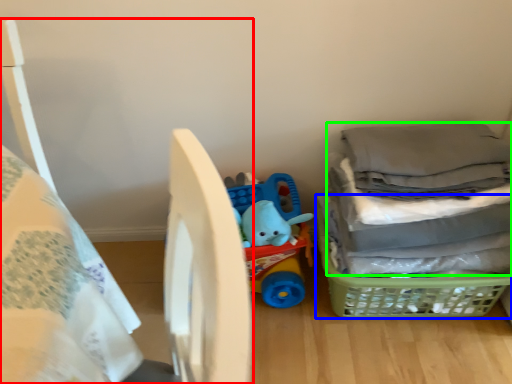
Question: Which object is positioned closest to bed (highlighted by a red box)? Select from basket (highlighted by a blue box) and laundry (highlighted by a green box).

Choices:
 (A) basket
 (B) laundry

Answer: (B)